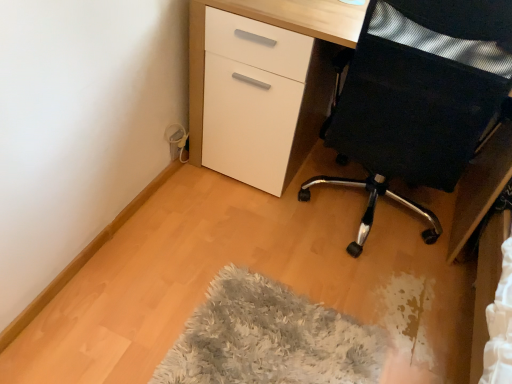
Locate an element on the screen. fluffy gray mat at lower center is located at coordinates (269, 339).

Is fluffy gray mat at lower center positioned far away from black mesh chair at right?

Actually, fluffy gray mat at lower center and black mesh chair at right are a little close together.

Which of these two, fluffy gray mat at lower center or black mesh chair at right, stands shorter?

With less height is fluffy gray mat at lower center.

Is fluffy gray mat at lower center aimed at black mesh chair at right?

No, fluffy gray mat at lower center is not aimed at black mesh chair at right.

From the image's perspective, who appears lower, white glossy desk at center or black mesh chair at right?

black mesh chair at right is shown below in the image.

Looking at the image, does white glossy desk at center seem bigger or smaller compared to black mesh chair at right?

white glossy desk at center is bigger than black mesh chair at right.

You are a GUI agent. You are given a task and a screenshot of the screen. Output one action in this format:
    pyautogui.click(x=<x>, y=<y>)
    Task: Click on the furniture located below the white glossy desk at center (from the image's perspective)
    The image size is (512, 384).
    Given the screenshot: What is the action you would take?
    pyautogui.click(x=420, y=97)

Which is behind, point (194, 141) or point (419, 46)?

The point (194, 141) is farther.

Measure the distance between black mesh chair at right and white glossy desk at center.

black mesh chair at right and white glossy desk at center are 12.94 inches apart.

Considering the sizes of objects black mesh chair at right and white glossy desk at center in the image provided, who is thinner, black mesh chair at right or white glossy desk at center?

black mesh chair at right.

Consider the image. Can you confirm if black mesh chair at right is smaller than white glossy desk at center?

Correct, black mesh chair at right occupies less space than white glossy desk at center.

Who is smaller, fluffy gray mat at lower center or white glossy desk at center?

fluffy gray mat at lower center is smaller.

From the image's perspective, which is below, fluffy gray mat at lower center or white glossy desk at center?

From the image's view, fluffy gray mat at lower center is below.

Do you think fluffy gray mat at lower center is within white glossy desk at center, or outside of it?

fluffy gray mat at lower center is located beyond the bounds of white glossy desk at center.

Can you confirm if white glossy desk at center is thinner than fluffy gray mat at lower center?

In fact, white glossy desk at center might be wider than fluffy gray mat at lower center.

Which of these two, white glossy desk at center or fluffy gray mat at lower center, is smaller?

fluffy gray mat at lower center is smaller.

Between white glossy desk at center and fluffy gray mat at lower center, which one appears on the right side from the viewer's perspective?

From the viewer's perspective, white glossy desk at center appears more on the right side.

Does point (198, 79) lie in front of point (312, 369)?

That is False.

How different are the orientations of black mesh chair at right and fluffy gray mat at lower center in degrees?

They differ by 90 degrees in their facing directions.

Where is `furniture in front of the fluffy gray mat at lower center`? The width and height of the screenshot is (512, 384). furniture in front of the fluffy gray mat at lower center is located at coordinates (420, 97).

Is black mesh chair at right wider than fluffy gray mat at lower center?

Incorrect, the width of black mesh chair at right does not surpass that of fluffy gray mat at lower center.

Considering the relative positions of black mesh chair at right and fluffy gray mat at lower center in the image provided, is black mesh chair at right to the right of fluffy gray mat at lower center from the viewer's perspective?

Correct, you'll find black mesh chair at right to the right of fluffy gray mat at lower center.

At what (x,y) coordinates should I click in order to perform the action: click on furniture above the fluffy gray mat at lower center (from the image's perspective). Please return your answer as a coordinate pair (x, y). Image resolution: width=512 pixels, height=384 pixels. Looking at the image, I should click on (420, 97).

Locate an element on the screen. The width and height of the screenshot is (512, 384). furniture above the white glossy desk at center (from a real-world perspective) is located at coordinates (420, 97).

In the scene shown: From the image, which object appears to be nearer to fluffy gray mat at lower center, white glossy desk at center or black mesh chair at right?

black mesh chair at right.

Considering their positions, is black mesh chair at right positioned further to fluffy gray mat at lower center than white glossy desk at center?

Based on the image, white glossy desk at center appears to be further to fluffy gray mat at lower center.

Looking at the image, which one is located closer to black mesh chair at right, fluffy gray mat at lower center or white glossy desk at center?

Among the two, white glossy desk at center is located nearer to black mesh chair at right.

Considering their positions, is fluffy gray mat at lower center positioned closer to white glossy desk at center than black mesh chair at right?

black mesh chair at right is closer to white glossy desk at center.

Considering their positions, is white glossy desk at center positioned further to black mesh chair at right than fluffy gray mat at lower center?

fluffy gray mat at lower center is positioned further to the anchor black mesh chair at right.

Looking at the image, which one is located closer to white glossy desk at center, black mesh chair at right or fluffy gray mat at lower center?

black mesh chair at right is closer to white glossy desk at center.

Locate an element on the screen. This screenshot has height=384, width=512. furniture between white glossy desk at center and fluffy gray mat at lower center vertically is located at coordinates (420, 97).